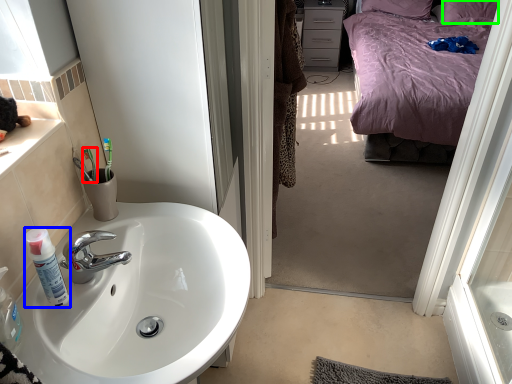
Question: Which object is the closest to the toothbrush (highlighted by a red box)? Choose among these: bottle (highlighted by a blue box) or pillow (highlighted by a green box).

Choices:
 (A) bottle
 (B) pillow

Answer: (A)